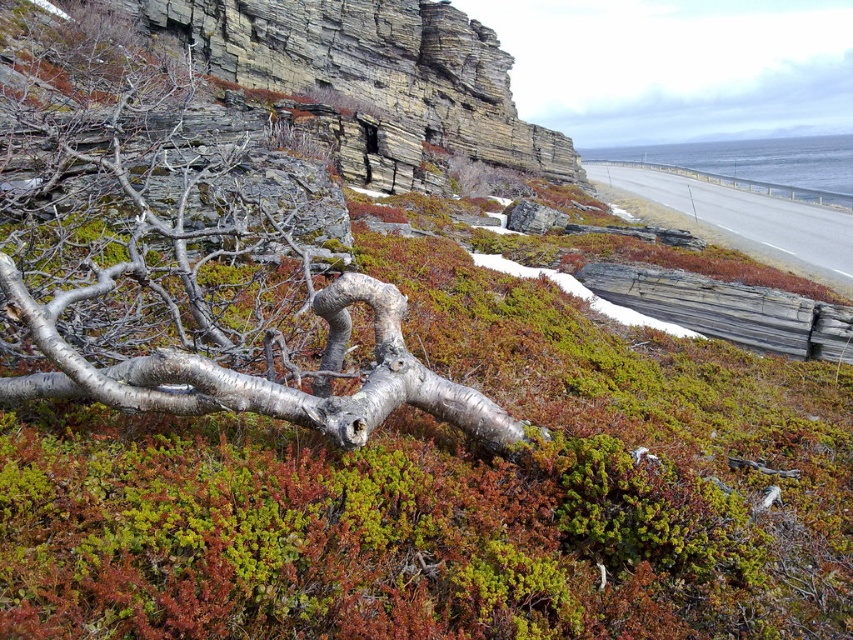
Question: Which point is closer to the camera taking this photo?

Choices:
 (A) (221, 477)
 (B) (393, 157)
 (C) (671, 195)

Answer: (A)

Question: Does silver metallic branch at center lie behind asphalt road at upper right?

Choices:
 (A) yes
 (B) no

Answer: (B)

Question: Can you confirm if silver metallic branch at center is wider than asphalt road at upper right?

Choices:
 (A) yes
 (B) no

Answer: (A)

Question: Which point is closer to the camera?

Choices:
 (A) (688, 497)
 (B) (451, 381)
 (C) (769, 227)

Answer: (A)

Question: Where is silver metallic branch at center located in relation to asphalt road at upper right in the image?

Choices:
 (A) above
 (B) below

Answer: (B)

Question: Which point appears closest to the camera in this image?

Choices:
 (A) (51, 419)
 (B) (688, 227)

Answer: (A)